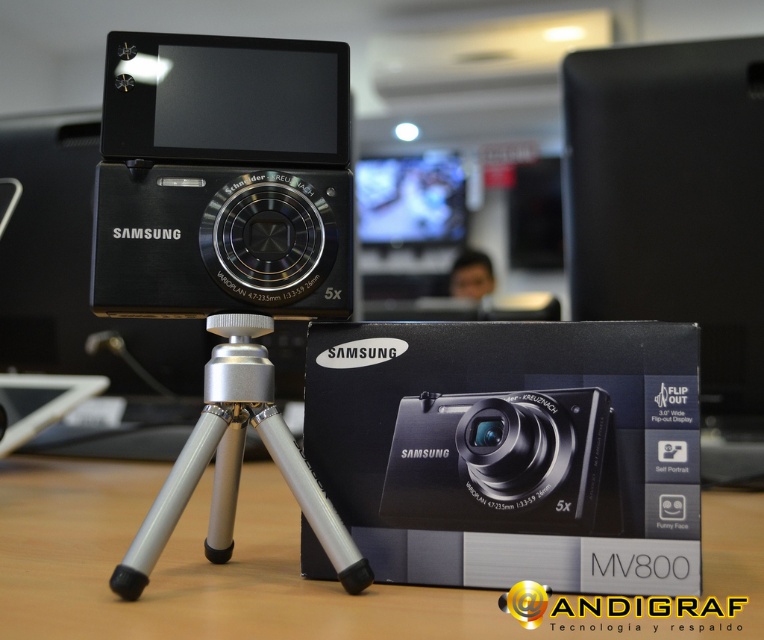
You are a photographer setting up equipment. You notice two points marked in the scene. The first point is at coordinate point (99, 484) and the second is at point (400, 496). Which point is closer to the camera?

Point (400, 496) is closer to the camera because it is in front of point (99, 484).

You are a photographer setting up equipment for a product shoot. You have a black metallic camera at center and a black matte samsung mv800 camera at center. Which camera is located to the left?

The black metallic camera at center is positioned on the left side of the black matte samsung mv800 camera at center, so the black metallic camera at center is the one located to the left.

You are a photographer setting up equipment for a product shoot. You have a black cardboard mv800 camera box at center and a black metallic camera at center in front of you. Which object is shorter in height?

The black cardboard mv800 camera box at center is shorter in height compared to the black metallic camera at center.